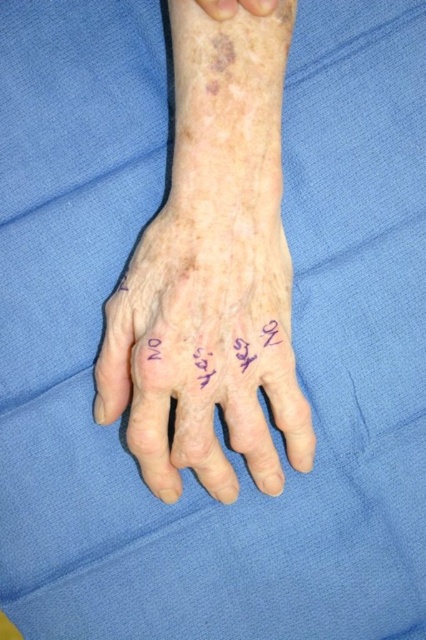
Is purple ink writing at center in front of leather-like skin at upper center?

That is False.

You are a GUI agent. You are given a task and a screenshot of the screen. Output one action in this format:
    pyautogui.click(x=<x>, y=<y>)
    Task: Click on the purple ink writing at center
    This screenshot has height=640, width=426.
    Given the screenshot: What is the action you would take?
    pyautogui.click(x=210, y=353)

In order to click on purple ink writing at center in this screenshot , I will do `click(210, 353)`.

Does dry skin hand at center have a larger size compared to purple ink writing at center?

Correct, dry skin hand at center is larger in size than purple ink writing at center.

Between dry skin hand at center and purple ink writing at center, which one appears on the left side from the viewer's perspective?

dry skin hand at center

The image size is (426, 640). What do you see at coordinates (204, 349) in the screenshot?
I see `dry skin hand at center` at bounding box center [204, 349].

Identify the location of dry skin hand at center. (204, 349).

Who is lower down, dry skin hand at center or leather-like skin at upper center?

dry skin hand at center

Can you confirm if dry skin hand at center is positioned to the left of leather-like skin at upper center?

Correct, you'll find dry skin hand at center to the left of leather-like skin at upper center.

At what (x,y) coordinates should I click in order to perform the action: click on dry skin hand at center. Please return your answer as a coordinate pair (x, y). This screenshot has height=640, width=426. Looking at the image, I should click on (204, 349).